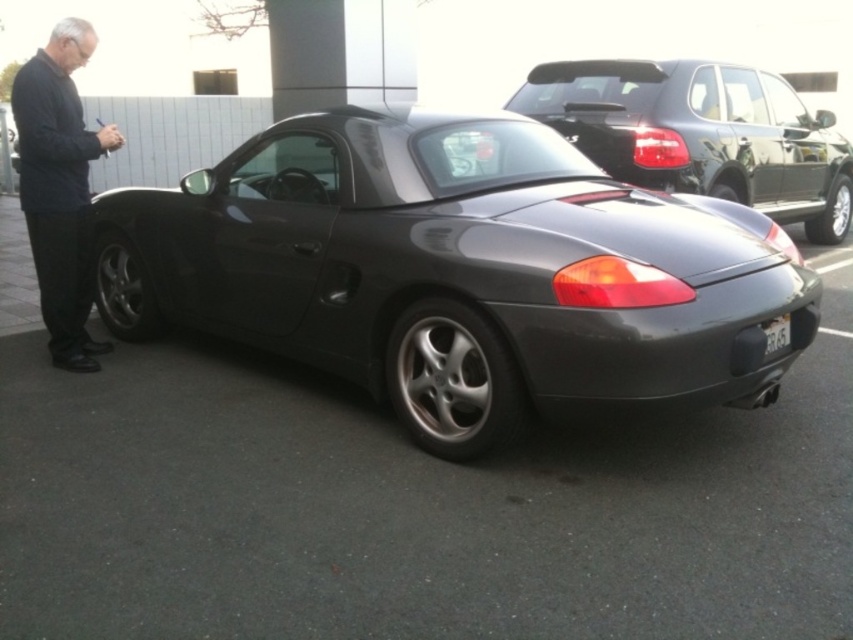
Between glossy black car at center and white plastic license plate at rear, which one appears on the left side from the viewer's perspective?

white plastic license plate at rear is more to the left.

Consider the image. Which of these two, glossy black car at center or white plastic license plate at rear, stands taller?

glossy black car at center is taller.

Locate an element on the screen. The height and width of the screenshot is (640, 853). glossy black car at center is located at coordinates (700, 132).

Is dark gray sweater at left shorter than white plastic license plate at rear?

Incorrect, dark gray sweater at left's height does not fall short of white plastic license plate at rear's.

Is dark gray sweater at left wider than white plastic license plate at rear?

Yes, dark gray sweater at left is wider than white plastic license plate at rear.

At what (x,y) coordinates should I click in order to perform the action: click on dark gray sweater at left. Please return your answer as a coordinate pair (x, y). This screenshot has height=640, width=853. Looking at the image, I should click on (61, 188).

Where is `dark gray sweater at left`? Image resolution: width=853 pixels, height=640 pixels. dark gray sweater at left is located at coordinates (61, 188).

Does satin black sports car at center appear over glossy black car at center?

No, satin black sports car at center is not above glossy black car at center.

Between satin black sports car at center and glossy black car at center, which one appears on the left side from the viewer's perspective?

Positioned to the left is satin black sports car at center.

In order to click on satin black sports car at center in this screenshot , I will do `click(457, 269)`.